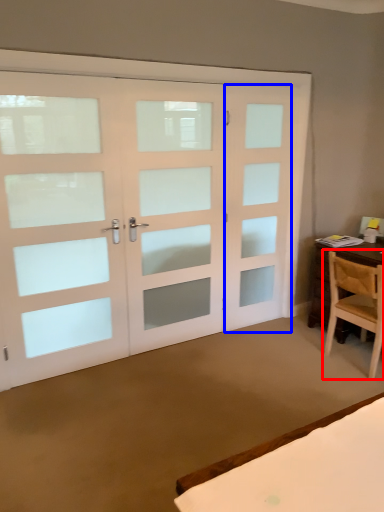
Question: Which object is closer to the camera taking this photo, chair (highlighted by a red box) or screen door (highlighted by a blue box)?

Choices:
 (A) chair
 (B) screen door

Answer: (A)